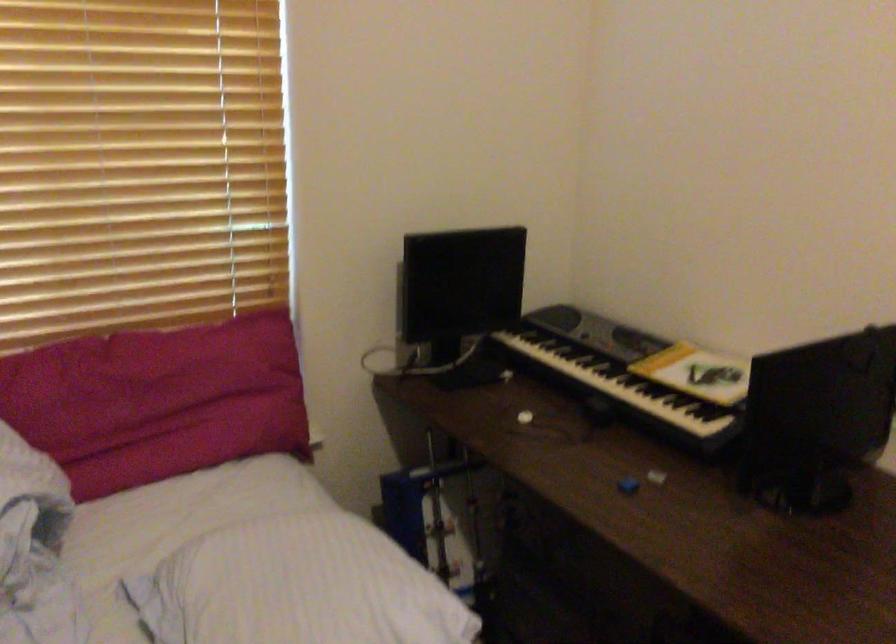
The width and height of the screenshot is (896, 644). What are the coordinates of `red pillow` in the screenshot? It's located at (159, 401).